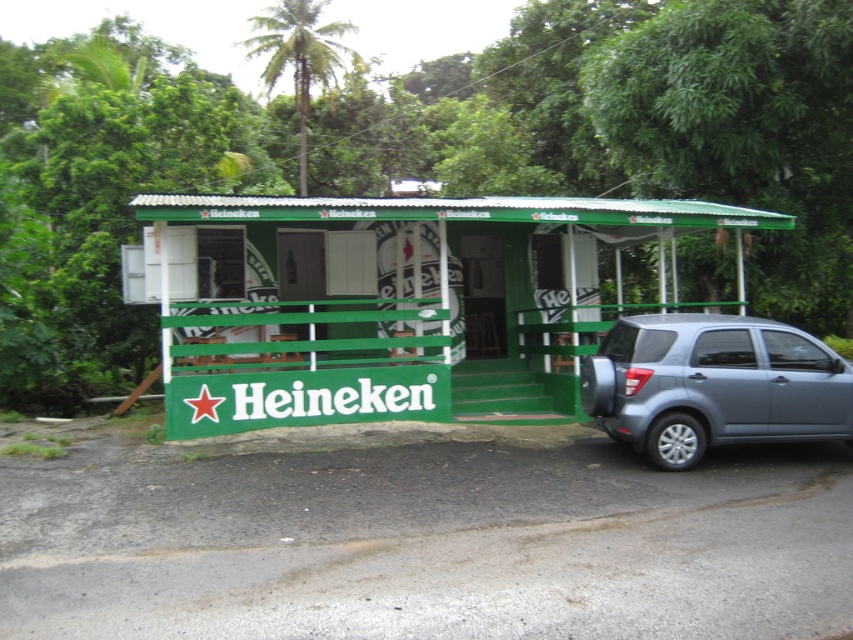
You are standing in front of the green painted wood hut at center and want to walk towards the gray metallic suv at right. Which direction should you move to reach the suv?

You should move towards the right since the gray metallic suv at right is positioned to the right side of the green painted wood hut at center.

You are standing at the entrance of the Heineken bar and want to place two decorative items on the floor. The first item should be placed at point (526, 256) and the second at point (653, 449). Which point is closer to you?

Point (526, 256) is closer to you because it is further to the viewer than point (653, 449).